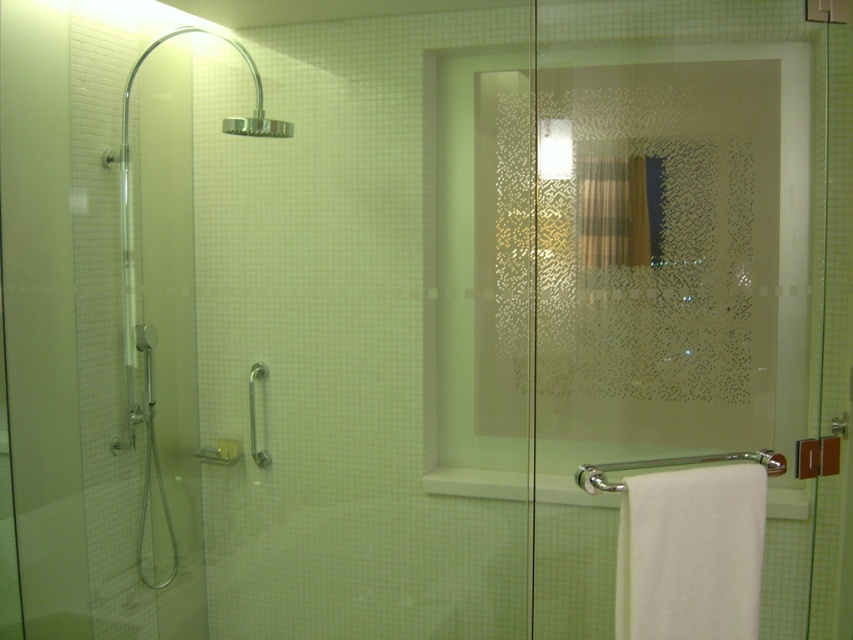
Where is `transparent glass shower door at left`? transparent glass shower door at left is located at coordinates (39, 317).

Does transparent glass shower door at left have a greater height compared to polished chrome towel bar at lower right?

Yes.

Measure the distance between transparent glass shower door at left and camera.

transparent glass shower door at left is 1.83 meters from camera.

Where is `transparent glass shower door at left`? The height and width of the screenshot is (640, 853). transparent glass shower door at left is located at coordinates (39, 317).

Between transparent glass shower door at left and silver metallic grab bar at lower left, which one has more height?

Standing taller between the two is transparent glass shower door at left.

Which is below, transparent glass shower door at left or silver metallic grab bar at lower left?

silver metallic grab bar at lower left

The image size is (853, 640). Describe the element at coordinates (39, 317) in the screenshot. I see `transparent glass shower door at left` at that location.

The image size is (853, 640). What are the coordinates of `transparent glass shower door at left` in the screenshot? It's located at (39, 317).

Is polished chrome towel bar at lower right below silver metallic grab bar at lower left?

Yes.

Identify the location of polished chrome towel bar at lower right. The height and width of the screenshot is (640, 853). (671, 465).